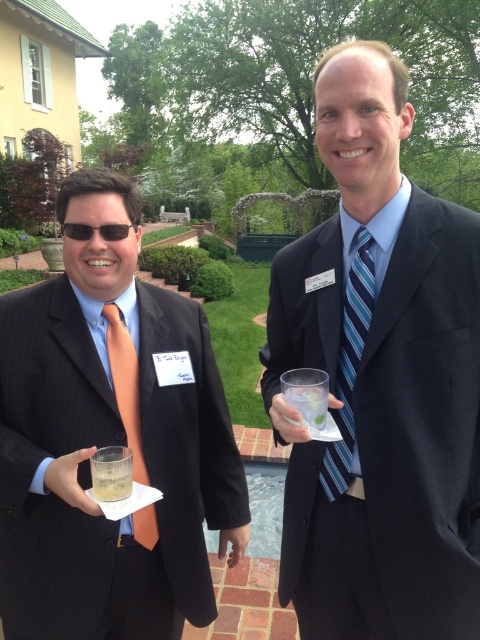
Question: Which point appears farthest from the camera in this image?

Choices:
 (A) (107, 474)
 (B) (148, 540)

Answer: (B)

Question: Can you confirm if dark blue suit at center is positioned below black plastic goggles at left?

Choices:
 (A) no
 (B) yes

Answer: (B)

Question: Estimate the real-world distances between objects in this image. Which object is farther from the blue striped tie at right?

Choices:
 (A) dark blue suit at center
 (B) clear plastic cup at center
 (C) translucent glass at center
 (D) black plastic goggles at left

Answer: (D)

Question: In this image, where is dark blue suit at center located relative to clear plastic cup at center?

Choices:
 (A) below
 (B) above

Answer: (B)

Question: Which of these objects is positioned farthest from the matte black suit at center?

Choices:
 (A) matte orange tie at left
 (B) dark blue suit at center
 (C) blue striped tie at right

Answer: (C)

Question: Is blue striped tie at right positioned before translucent glass at center?

Choices:
 (A) no
 (B) yes

Answer: (A)